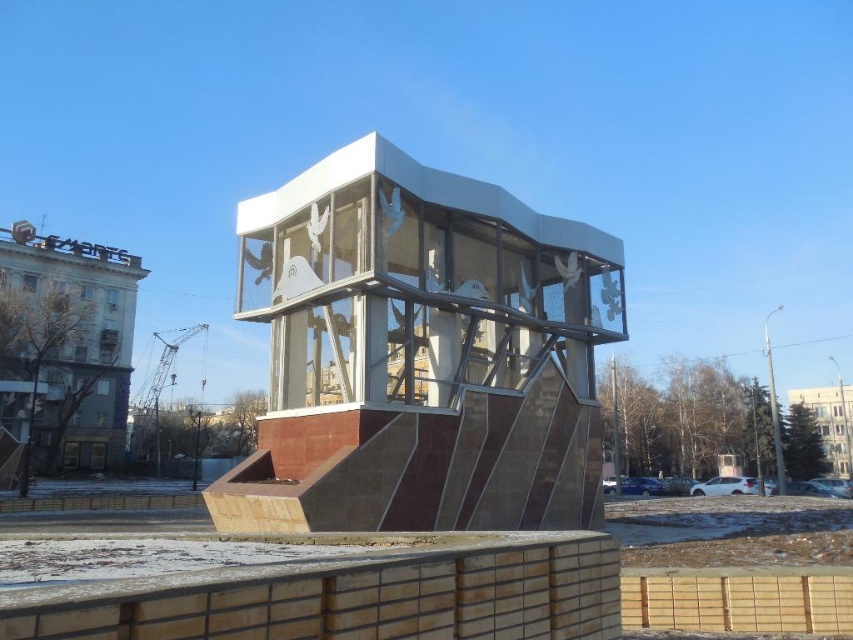
Is white glossy sculpture at center to the left of white glossy dove at center from the viewer's perspective?

In fact, white glossy sculpture at center is to the right of white glossy dove at center.

Measure the distance between white glossy sculpture at center and camera.

They are 10.69 meters apart.

Identify the location of white glossy sculpture at center. Image resolution: width=853 pixels, height=640 pixels. (421, 355).